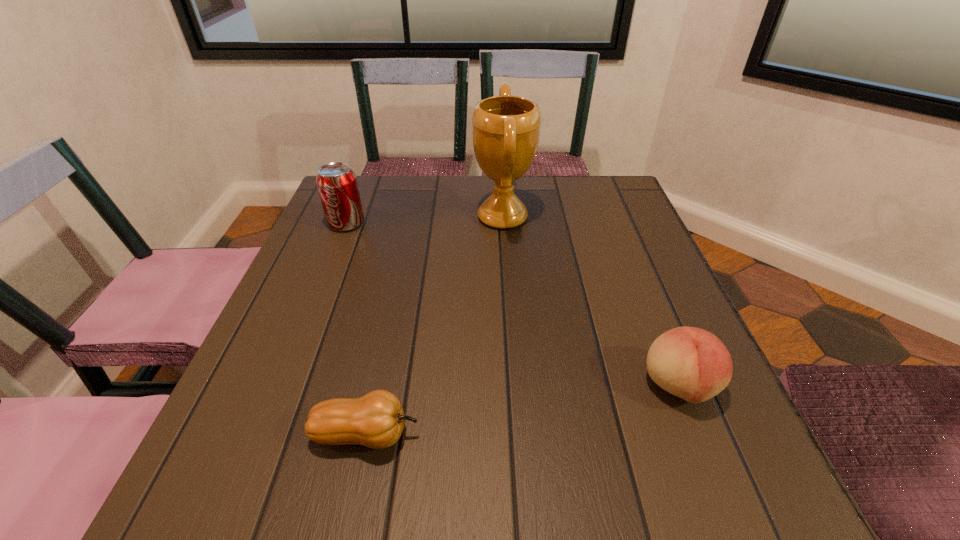
You are a GUI agent. You are given a task and a screenshot of the screen. Output one action in this format:
    pyautogui.click(x=<x>, y=<y>)
    Task: Click on the empty space between the soda can and the gourd
    The width and height of the screenshot is (960, 540).
    Given the screenshot: What is the action you would take?
    point(356,329)

The height and width of the screenshot is (540, 960). I want to click on vacant space that's between the rightmost object and the third object from left to right, so click(x=590, y=301).

You are a GUI agent. You are given a task and a screenshot of the screen. Output one action in this format:
    pyautogui.click(x=<x>, y=<y>)
    Task: Click on the vacant space that is in between the soda can and the third object from left to right
    The width and height of the screenshot is (960, 540).
    Given the screenshot: What is the action you would take?
    pyautogui.click(x=424, y=220)

Identify the location of free spot between the gourd and the peach. This screenshot has width=960, height=540. (522, 410).

You are a GUI agent. You are given a task and a screenshot of the screen. Output one action in this format:
    pyautogui.click(x=<x>, y=<y>)
    Task: Click on the free spot between the peach and the shortest object
    
    Given the screenshot: What is the action you would take?
    pyautogui.click(x=522, y=410)

Where is `free spot between the third object from left to right and the third object from right to left`? This screenshot has width=960, height=540. free spot between the third object from left to right and the third object from right to left is located at coordinates (434, 326).

This screenshot has width=960, height=540. What are the coordinates of `vacant space in between the tallest object and the rightmost object` in the screenshot? It's located at (590, 301).

Where is `free space between the gourd and the award`? free space between the gourd and the award is located at coordinates (434, 326).

I want to click on vacant space in between the shortest object and the award, so (434, 326).

Identify which object is the nearest to the tallest object. Please provide its 2D coordinates. Your answer should be formatted as a tuple, i.e. [(x, y)], where the tuple contains the x and y coordinates of a point satisfying the conditions above.

[(337, 185)]